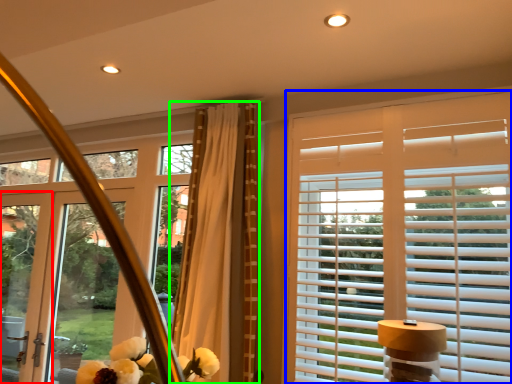
Question: Considering the real-world distances, which object is closest to screen door (highlighted by a red box)? window blind (highlighted by a blue box) or curtain (highlighted by a green box).

Choices:
 (A) window blind
 (B) curtain

Answer: (B)